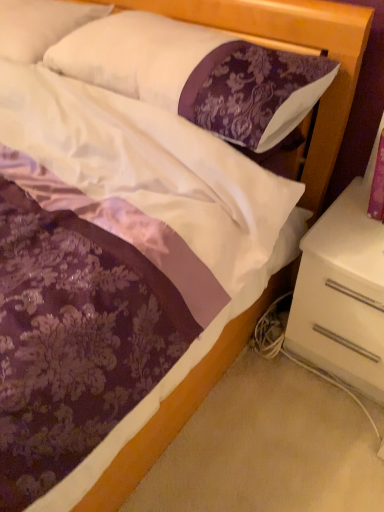
Question: Considering the positions of white glossy nightstand at lower right and purple damask pillow at upper center, acting as the first pillow starting from the right, in the image, is white glossy nightstand at lower right wider or thinner than purple damask pillow at upper center, acting as the first pillow starting from the right,?

Choices:
 (A) wide
 (B) thin

Answer: (A)

Question: Considering the positions of white glossy nightstand at lower right and purple damask pillow at upper center, the 2th pillow when ordered from left to right, in the image, is white glossy nightstand at lower right bigger or smaller than purple damask pillow at upper center, the 2th pillow when ordered from left to right,?

Choices:
 (A) small
 (B) big

Answer: (B)

Question: Estimate the real-world distances between objects in this image. Which object is closer to the white soft pillow at upper left, the second pillow positioned from the right?

Choices:
 (A) white glossy nightstand at lower right
 (B) purple damask pillow at upper center, the 2th pillow when ordered from left to right

Answer: (B)

Question: Considering the real-world distances, which object is farthest from the purple damask pillow at upper center, acting as the first pillow starting from the right?

Choices:
 (A) white glossy nightstand at lower right
 (B) white soft pillow at upper left, the 1th pillow from the left

Answer: (A)